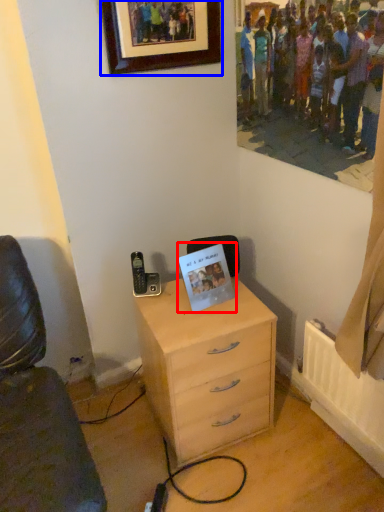
Question: Which point is further to the camera, postcard (highlighted by a red box) or picture frame (highlighted by a blue box)?

Choices:
 (A) postcard
 (B) picture frame

Answer: (A)